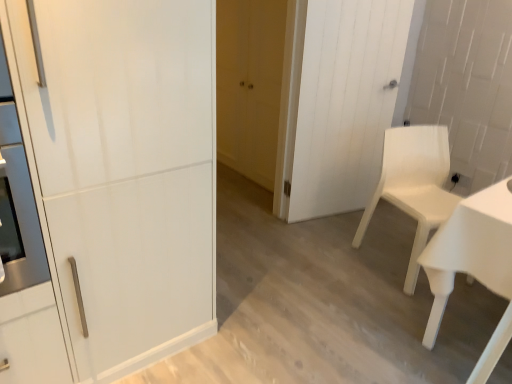
At what (x,y) coordinates should I click in order to perform the action: click on free space below white wood door at center, the 3th door positioned from the left (from a real-world perspective). Please return your answer as a coordinate pair (x, y). The width and height of the screenshot is (512, 384). Looking at the image, I should click on (325, 211).